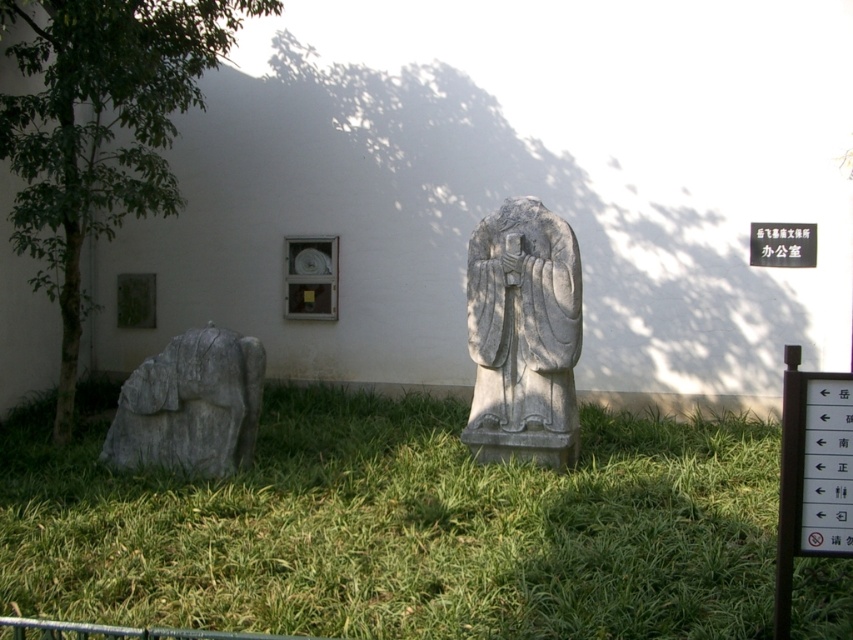
Can you confirm if green leafy tree at left is shorter than gray stone statue at lower left?

In fact, green leafy tree at left may be taller than gray stone statue at lower left.

Between green leafy tree at left and gray stone statue at lower left, which one has more height?

Standing taller between the two is green leafy tree at left.

Locate an element on the screen. Image resolution: width=853 pixels, height=640 pixels. green leafy tree at left is located at coordinates (99, 131).

Find the location of `green leafy tree at left`. green leafy tree at left is located at coordinates pyautogui.click(x=99, y=131).

Is gray stone statue at center thinner than white paper sign at upper center?

No, gray stone statue at center is not thinner than white paper sign at upper center.

Can you confirm if gray stone statue at center is positioned to the right of white paper sign at upper center?

Incorrect, gray stone statue at center is not on the right side of white paper sign at upper center.

Describe the element at coordinates (523, 336) in the screenshot. Image resolution: width=853 pixels, height=640 pixels. I see `gray stone statue at center` at that location.

Locate an element on the screen. The image size is (853, 640). gray stone statue at center is located at coordinates (523, 336).

Is green leafy tree at left above gray stone statue at center?

Yes.

Between green leafy tree at left and gray stone statue at center, which one appears on the left side from the viewer's perspective?

green leafy tree at left

Which is behind, point (61, 291) or point (561, 349)?

The point (61, 291) is behind.

You are a GUI agent. You are given a task and a screenshot of the screen. Output one action in this format:
    pyautogui.click(x=<x>, y=<y>)
    Task: Click on the green leafy tree at left
    The height and width of the screenshot is (640, 853).
    Given the screenshot: What is the action you would take?
    (99, 131)